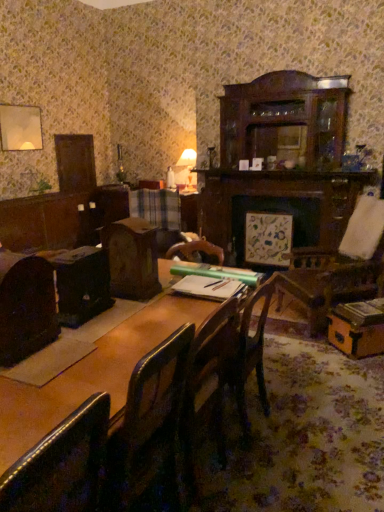
You are a GUI agent. You are given a task and a screenshot of the screen. Output one action in this format:
    pyautogui.click(x=<x>, y=<y>)
    Task: Click on the leather at left, which ranks as the first chair in bottom-to-top order
    This screenshot has height=512, width=384.
    Given the screenshot: What is the action you would take?
    pyautogui.click(x=62, y=465)

The width and height of the screenshot is (384, 512). Describe the element at coordinates (186, 170) in the screenshot. I see `matte white table lamp at upper center` at that location.

Measure the distance between wooden table at center and camera.

wooden table at center is 1.10 meters away from camera.

Find the location of `leather at left, which ranks as the first chair in bottom-to-top order`. leather at left, which ranks as the first chair in bottom-to-top order is located at coordinates (62, 465).

From a real-world perspective, relative to leather at left, which is the second chair in top-to-bottom order, is wooden table at center vertically above or below?

wooden table at center is below leather at left, which is the second chair in top-to-bottom order.

Based on the photo, is wooden table at center facing away from leather at left, which is the second chair in top-to-bottom order?

Yes.

Does wooden table at center appear on the right side of leather at left, which ranks as the first chair in bottom-to-top order?

Indeed, wooden table at center is positioned on the right side of leather at left, which ranks as the first chair in bottom-to-top order.

The height and width of the screenshot is (512, 384). Identify the location of table on the right of leather at left, which ranks as the first chair in bottom-to-top order. pos(90,373).

Looking at this image, are leather at left, the 2th chair positioned from the back, and dark brown leather chair at left, positioned as the second chair in bottom-to-top order, far apart?

leather at left, the 2th chair positioned from the back, is near dark brown leather chair at left, positioned as the second chair in bottom-to-top order, not far away.

Is leather at left, the 2th chair positioned from the back, taller or shorter than dark brown leather chair at left, arranged as the 1th chair when viewed from the back?

Clearly, leather at left, the 2th chair positioned from the back, is taller compared to dark brown leather chair at left, arranged as the 1th chair when viewed from the back.

Is dark brown leather chair at left, which is the 2th chair in front-to-back order, a part of leather at left, which is the second chair in top-to-bottom order?

Definitely not — dark brown leather chair at left, which is the 2th chair in front-to-back order, is not inside leather at left, which is the second chair in top-to-bottom order.

Does leather at left, the 1th chair in the front-to-back sequence, have a larger size compared to dark brown leather chair at left, which is the 2th chair in front-to-back order?

Correct, leather at left, the 1th chair in the front-to-back sequence, is larger in size than dark brown leather chair at left, which is the 2th chair in front-to-back order.

Relative to matte white table lamp at upper center, is leather at left, the 2th chair positioned from the back, in front or behind?

leather at left, the 2th chair positioned from the back, is positioned closer to the viewer than matte white table lamp at upper center.

From a real-world perspective, which is physically below, leather at left, the 1th chair in the front-to-back sequence, or matte white table lamp at upper center?

From a 3D spatial view, leather at left, the 1th chair in the front-to-back sequence, is below.

Is leather at left, which ranks as the first chair in bottom-to-top order, outside of matte white table lamp at upper center?

Indeed, leather at left, which ranks as the first chair in bottom-to-top order, is completely outside matte white table lamp at upper center.

Considering the relative sizes of leather at left, the 2th chair positioned from the back, and matte white table lamp at upper center in the image provided, is leather at left, the 2th chair positioned from the back, thinner than matte white table lamp at upper center?

Incorrect, the width of leather at left, the 2th chair positioned from the back, is not less than that of matte white table lamp at upper center.

Identify the location of chair that is the 2nd one when counting leftward from the wooden table at center. This screenshot has height=512, width=384. (26, 306).

Considering the relative sizes of wooden table at center and dark brown leather chair at left, positioned as the second chair in bottom-to-top order, in the image provided, is wooden table at center taller than dark brown leather chair at left, positioned as the second chair in bottom-to-top order,?

Correct, wooden table at center is much taller as dark brown leather chair at left, positioned as the second chair in bottom-to-top order.

From a real-world perspective, is wooden table at center positioned over dark brown leather chair at left, positioned as the second chair in bottom-to-top order, based on gravity?

No, from a real-world perspective, wooden table at center is not above dark brown leather chair at left, positioned as the second chair in bottom-to-top order.

How different are the orientations of wooden table at center and dark brown leather chair at left, positioned as the 1th chair in top-to-bottom order, in degrees?

The facing directions of wooden table at center and dark brown leather chair at left, positioned as the 1th chair in top-to-bottom order, are 93.9 degrees apart.

Does matte white table lamp at upper center have a greater height compared to leather at left, the 2th chair positioned from the back?

In fact, matte white table lamp at upper center may be shorter than leather at left, the 2th chair positioned from the back.

Is leather at left, the 1th chair in the front-to-back sequence, at the back of matte white table lamp at upper center?

No, matte white table lamp at upper center is not facing away from leather at left, the 1th chair in the front-to-back sequence.

Can we say matte white table lamp at upper center lies outside leather at left, the 2th chair positioned from the back?

matte white table lamp at upper center is positioned outside leather at left, the 2th chair positioned from the back.

Who is taller, matte white table lamp at upper center or dark brown leather chair at left, arranged as the 1th chair when viewed from the back?

matte white table lamp at upper center is taller.

From a real-world perspective, is matte white table lamp at upper center above or below dark brown leather chair at left, which is the 2th chair in front-to-back order?

matte white table lamp at upper center is above dark brown leather chair at left, which is the 2th chair in front-to-back order.

Does matte white table lamp at upper center lie in front of dark brown leather chair at left, arranged as the 1th chair when viewed from the back?

No.

How many degrees apart are the facing directions of matte white table lamp at upper center and dark brown leather chair at left, positioned as the 1th chair in top-to-bottom order?

The angular difference between matte white table lamp at upper center and dark brown leather chair at left, positioned as the 1th chair in top-to-bottom order, is 88.3 degrees.

Is matte white table lamp at upper center taller than wooden table at center?

No.

Is point (194, 185) positioned before point (115, 354)?

No.

Which object is thinner, matte white table lamp at upper center or wooden table at center?

matte white table lamp at upper center.

Which object is positioned more to the right, matte white table lamp at upper center or wooden table at center?

From the viewer's perspective, matte white table lamp at upper center appears more on the right side.

Identify the location of chair that is below the wooden table at center (from the image's perspective). The width and height of the screenshot is (384, 512). (62, 465).

The height and width of the screenshot is (512, 384). I want to click on chair that appears above the leather at left, which ranks as the first chair in bottom-to-top order (from a real-world perspective), so click(26, 306).

When comparing their distances from matte white table lamp at upper center, does dark brown leather chair at left, arranged as the 1th chair when viewed from the back, or leather at left, the 2th chair positioned from the back, seem closer?

Among the two, dark brown leather chair at left, arranged as the 1th chair when viewed from the back, is located nearer to matte white table lamp at upper center.

Looking at the image, which one is located closer to wooden table at center, leather at left, which is the second chair in top-to-bottom order, or matte white table lamp at upper center?

leather at left, which is the second chair in top-to-bottom order, is closer to wooden table at center.

Considering their positions, is leather at left, which is the second chair in top-to-bottom order, positioned closer to dark brown leather chair at left, arranged as the 1th chair when viewed from the back, than wooden table at center?

wooden table at center is positioned closer to the anchor dark brown leather chair at left, arranged as the 1th chair when viewed from the back.

Based on their spatial positions, is wooden table at center or leather at left, the 2th chair positioned from the back, further from dark brown leather chair at left, positioned as the 1th chair in top-to-bottom order?

leather at left, the 2th chair positioned from the back.

When comparing their distances from leather at left, the 2th chair positioned from the back, does matte white table lamp at upper center or wooden table at center seem further?

Among the two, matte white table lamp at upper center is located further to leather at left, the 2th chair positioned from the back.

Considering their positions, is matte white table lamp at upper center positioned closer to wooden table at center than dark brown leather chair at left, which is the 2th chair in front-to-back order?

dark brown leather chair at left, which is the 2th chair in front-to-back order, is closer to wooden table at center.

Looking at the image, which one is located further to dark brown leather chair at left, positioned as the second chair in bottom-to-top order, wooden table at center or matte white table lamp at upper center?

Based on the image, matte white table lamp at upper center appears to be further to dark brown leather chair at left, positioned as the second chair in bottom-to-top order.

From the image, which object appears to be nearer to matte white table lamp at upper center, wooden table at center or dark brown leather chair at left, arranged as the 1th chair when viewed from the back?

wooden table at center is closer to matte white table lamp at upper center.

Image resolution: width=384 pixels, height=512 pixels. Identify the location of table positioned between leather at left, which ranks as the first chair in bottom-to-top order, and dark brown leather chair at left, which is the 2th chair in front-to-back order, from near to far. (90, 373).

The image size is (384, 512). Find the location of `chair positioned between leather at left, which ranks as the first chair in bottom-to-top order, and matte white table lamp at upper center from near to far`. chair positioned between leather at left, which ranks as the first chair in bottom-to-top order, and matte white table lamp at upper center from near to far is located at coordinates (26, 306).

The width and height of the screenshot is (384, 512). Identify the location of table located between leather at left, the 2th chair positioned from the back, and matte white table lamp at upper center in the depth direction. (90, 373).

The width and height of the screenshot is (384, 512). What are the coordinates of `chair between wooden table at center and matte white table lamp at upper center along the z-axis` in the screenshot? It's located at (26, 306).